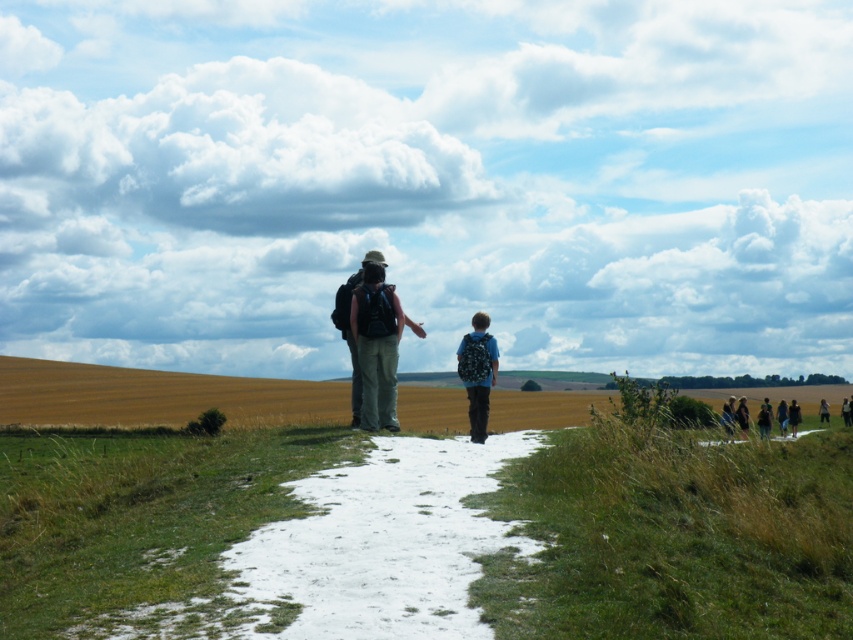
Question: Among these points, which one is farthest from the camera?

Choices:
 (A) (367, 513)
 (B) (393, 365)

Answer: (B)

Question: Is golden wheat field at center above matte blue backpack at center?

Choices:
 (A) yes
 (B) no

Answer: (B)

Question: Does matte black backpack at center have a lesser width compared to dark blue backpack at center?

Choices:
 (A) yes
 (B) no

Answer: (A)

Question: Which is nearer to the golden wheat field at center?

Choices:
 (A) matte blue backpack at center
 (B) matte black backpack at center
 (C) dark blue backpack at center

Answer: (B)

Question: Which of the following is the farthest from the observer?

Choices:
 (A) golden wheat field at center
 (B) matte blue backpack at center
 (C) white snow at center

Answer: (A)

Question: Is white snow at center above matte blue backpack at center?

Choices:
 (A) no
 (B) yes

Answer: (A)